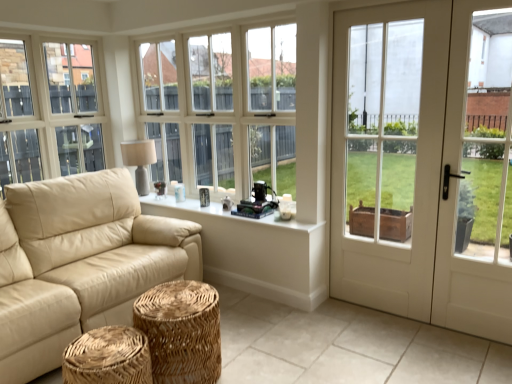
You are a GUI agent. You are given a task and a screenshot of the screen. Output one action in this format:
    pyautogui.click(x=<x>, y=<y>)
    Task: Click on the blank space situated above woven natural stool at center, placed as the second stool when sorted from front to back (from a real-world perspective)
    Image resolution: width=512 pixels, height=384 pixels.
    Given the screenshot: What is the action you would take?
    pyautogui.click(x=181, y=301)